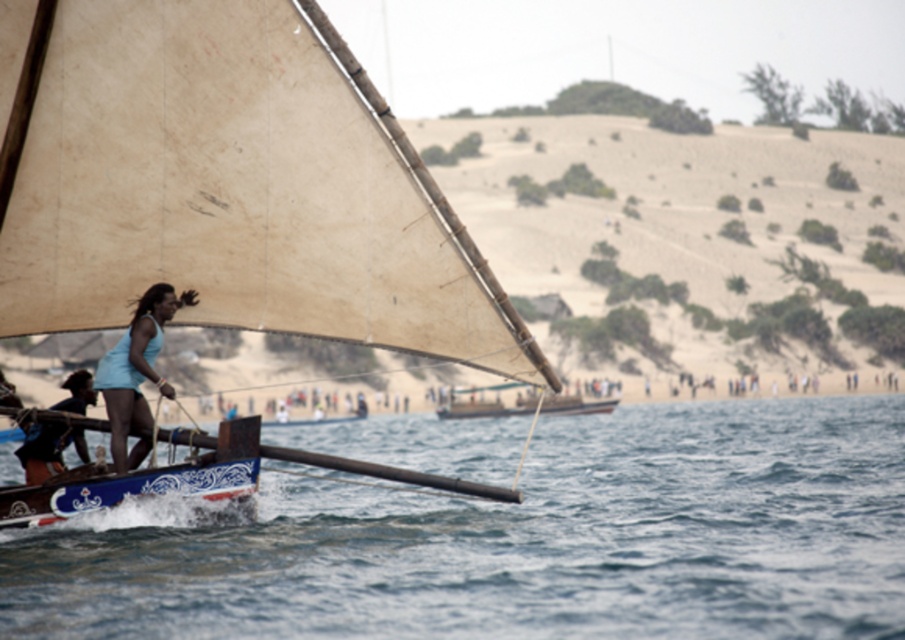
You are on the sailboat and want to move from the point at coordinates point (301,429) to the point at point (119,394). Which direction should you move relative to the boat?

You should move forward towards the bow of the boat because point (301,429) is behind point (119,394).

You are a sailor on the dhow and need to reach a buoy located at the light blue fabric at center. The boat is currently positioned at the blue water at lower left. Given that the boat can travel at 4 meters per minute, how many minutes will it take to reach the buoy?

The blue water at lower left is 32.85 meters from the light blue fabric at center. At a speed of 4 meters per minute, it will take 32.85 divided by 4, which equals approximately 8.21 minutes. So, it will take about 8.21 minutes to reach the buoy.

You are on the sailboat and want to reach the two points marked in the image. Which point, point (163,467) or point (53,428), is closer to you?

Point (163,467) is closer to the camera than point (53,428).